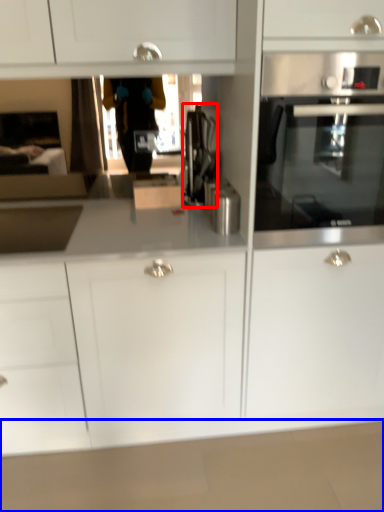
Question: Among these objects, which one is nearest to the camera, coffee machine (highlighted by a red box) or counter top (highlighted by a blue box)?

Choices:
 (A) coffee machine
 (B) counter top

Answer: (B)